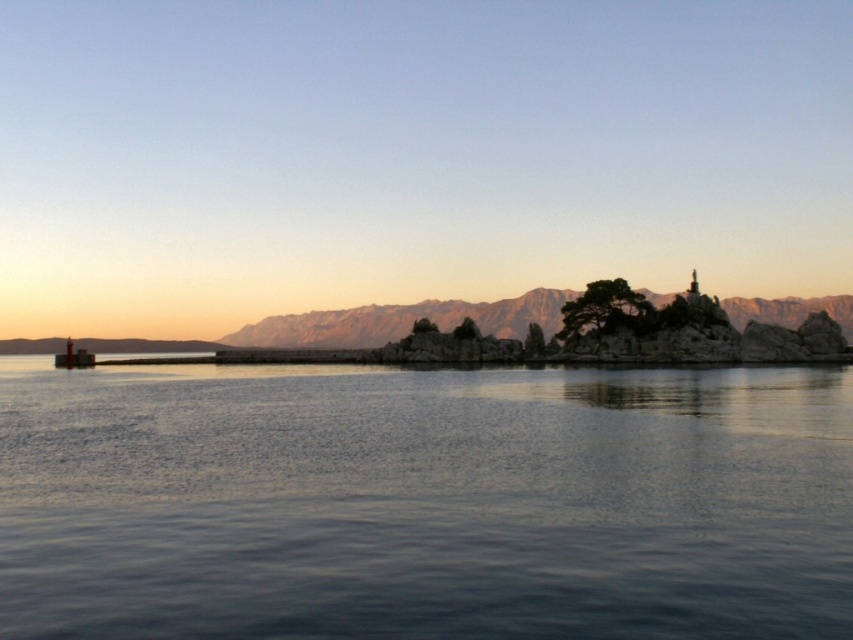
Who is shorter, dark blue water at center or rocky cliff at center?

Standing shorter between the two is dark blue water at center.

This screenshot has height=640, width=853. What are the coordinates of `dark blue water at center` in the screenshot? It's located at (424, 502).